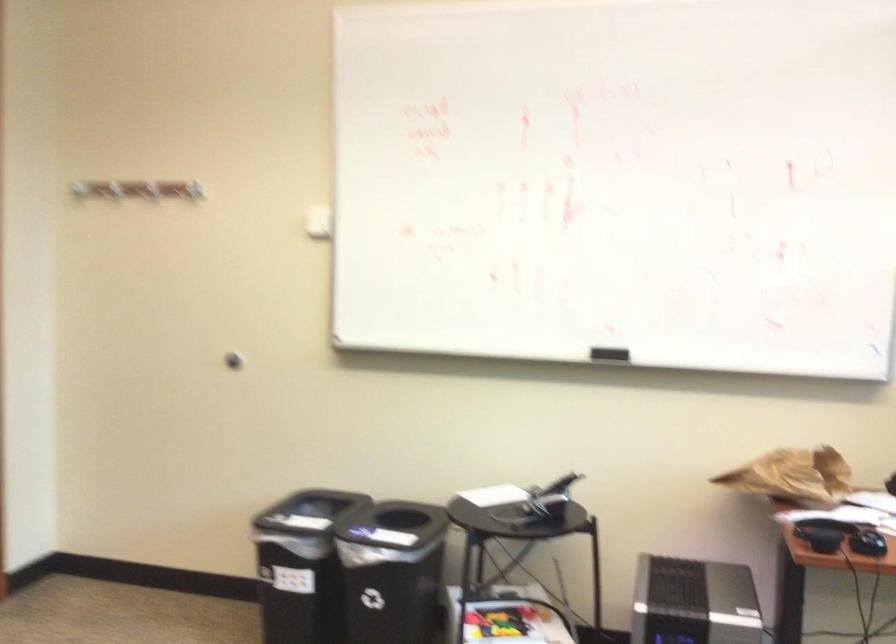
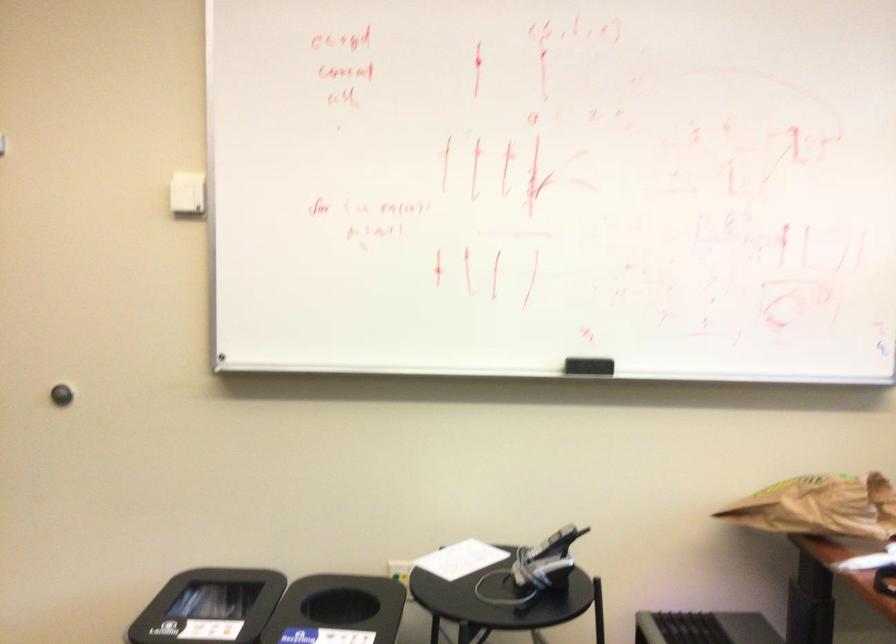
The point at [610,354] is marked in the first image. Where is the corresponding point in the second image?

(588, 366)